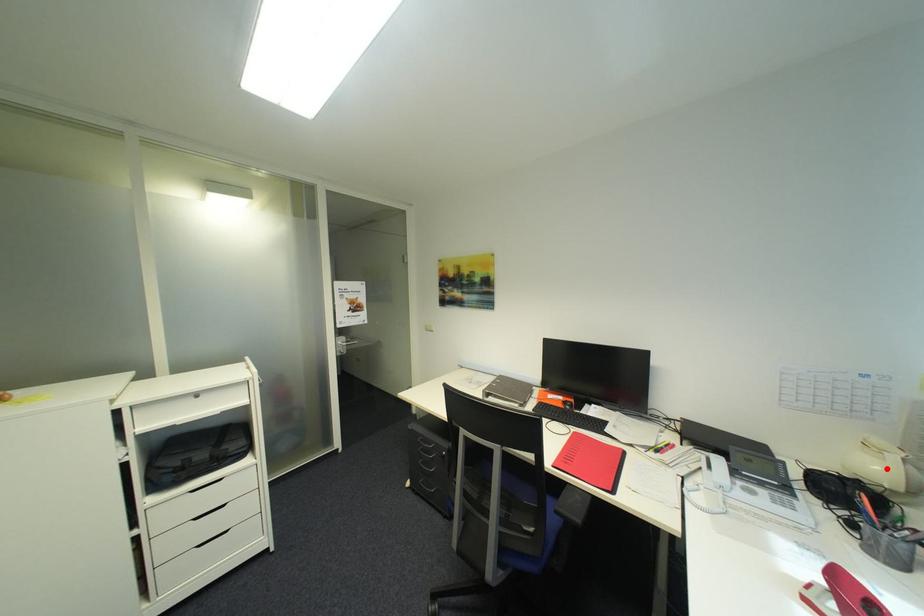
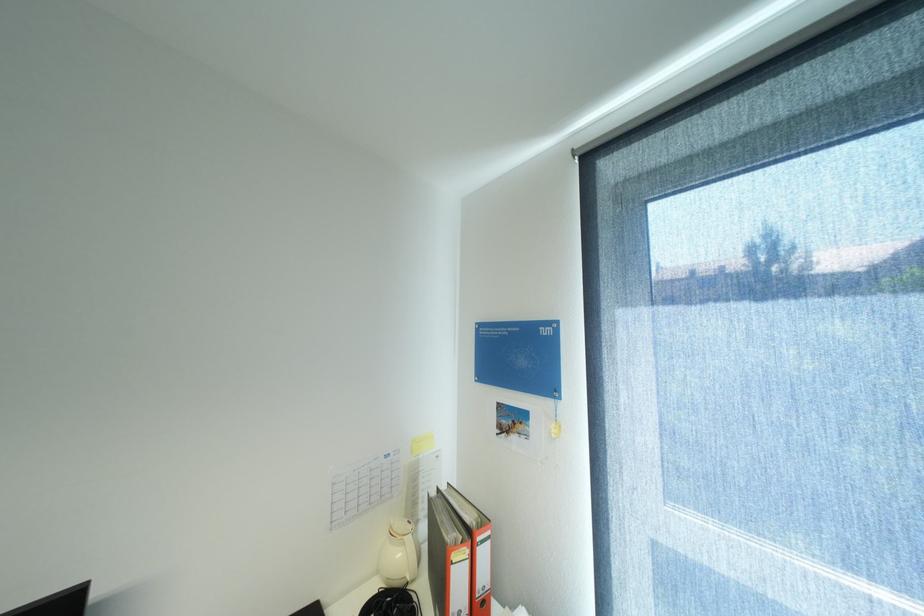
Question: A red point is marked in image1. In image2, is the corresponding 3D point closer to the camera or farther? Reply with the corresponding letter.

Choices:
 (A) The corresponding 3D point is closer.
 (B) The corresponding 3D point is farther.

Answer: (B)